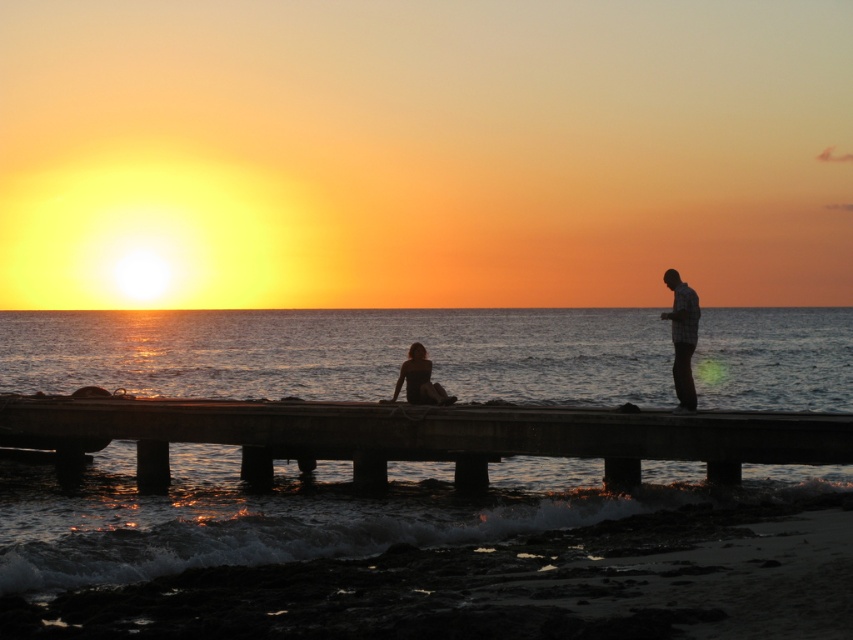
You are standing on the beach and want to take a photo of the sunset. You notice the concrete dock at center and the silhouette figure at center in your viewfinder. Which object should you focus on first to ensure it appears sharp in the photo?

You should focus on the concrete dock at center first because it is in front of the silhouette figure at center, making it closer to the camera and thus requiring proper focus first.

You are standing on the beach and want to take a photo of the plaid shirt at right and the concrete dock at center. Which object should you focus on first to ensure both are in the frame?

You should focus on the concrete dock at center first because it is closer to you than the plaid shirt at right, ensuring both are in the frame.

You are planning to place a small bench on the concrete dock at center. Considering the silhouette figure at center is already standing there, will there be enough space for the bench without overlapping?

The concrete dock at center is wider than the silhouette figure at center, so there should be enough space to place the bench alongside the figure without overlapping.